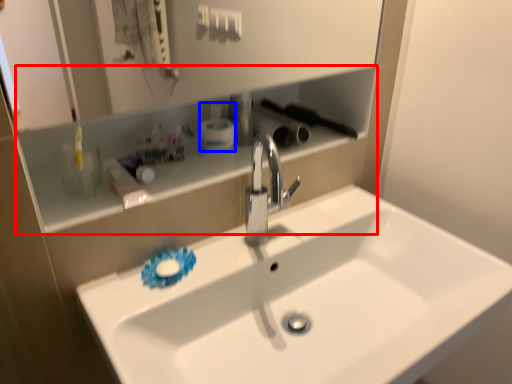
Question: Among these objects, which one is farthest to the camera, shelve (highlighted by a red box) or mouthwash (highlighted by a blue box)?

Choices:
 (A) shelve
 (B) mouthwash

Answer: (B)